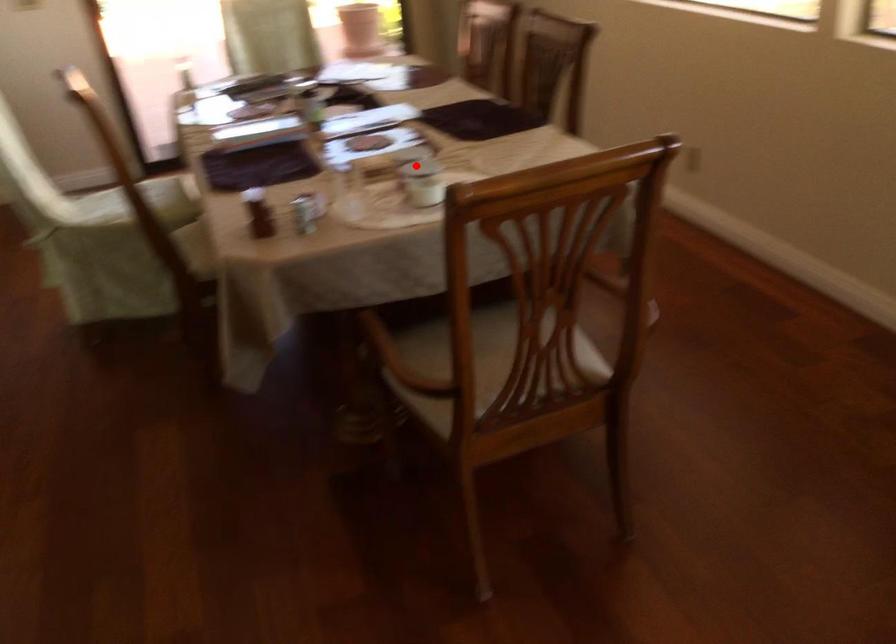
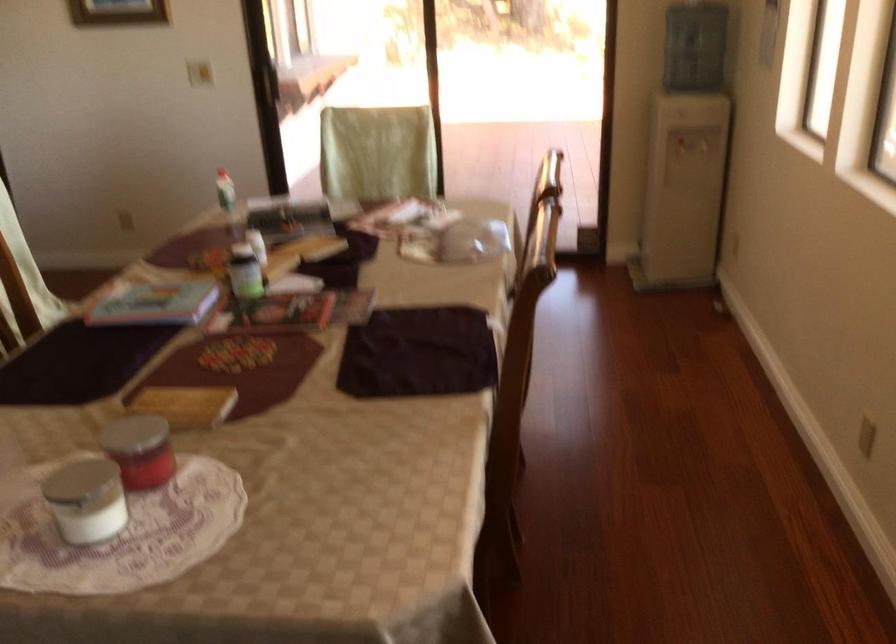
Question: I am providing you with two images of the same scene from different viewpoints. In image1, a red point is highlighted. Considering the same 3D point in image2, which of the following is correct?

Choices:
 (A) It is closer
 (B) It is farther

Answer: (A)